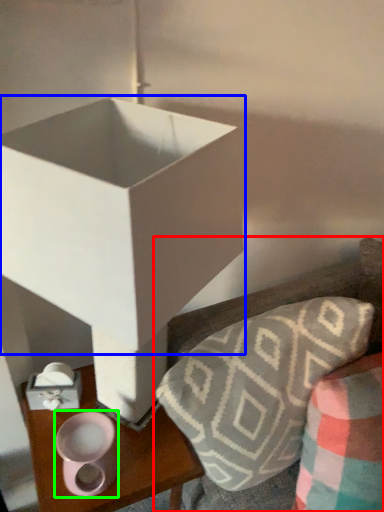
Question: Which object is positioned closest to furniture (highlighted by a red box)? Select from box (highlighted by a blue box) and candle holder (highlighted by a green box).

Choices:
 (A) box
 (B) candle holder

Answer: (A)